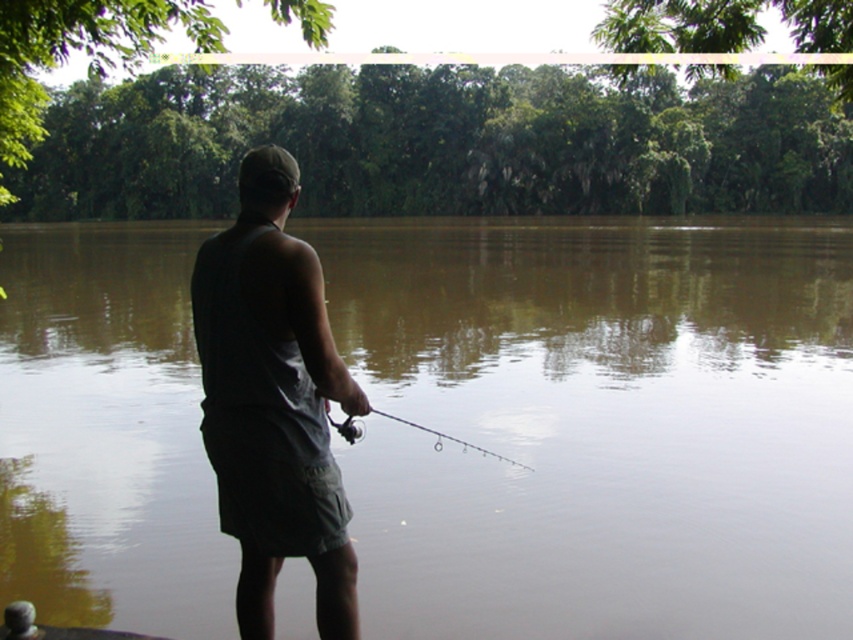
Question: Is brown murky water at center closer to the viewer compared to dark gray fabric tank top at center?

Choices:
 (A) yes
 (B) no

Answer: (B)

Question: Which of the following is the farthest from the observer?

Choices:
 (A) [x=375, y=272]
 (B) [x=434, y=449]

Answer: (A)

Question: Is dark gray fabric tank top at center behind clear plastic rod at center?

Choices:
 (A) no
 (B) yes

Answer: (A)

Question: Among these points, which one is farthest from the camera?

Choices:
 (A) (384, 413)
 (B) (281, 513)
 (C) (152, 234)

Answer: (C)

Question: Which point is farther to the camera?

Choices:
 (A) (244, 184)
 (B) (503, 458)

Answer: (B)

Question: Does brown murky water at center lie behind clear plastic rod at center?

Choices:
 (A) no
 (B) yes

Answer: (A)